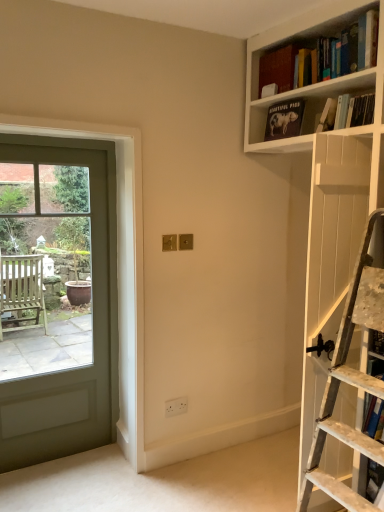
What are the coordinates of `matte black book at upper right, acting as the 4th book starting from the bottom` in the screenshot? It's located at (284, 119).

What do you see at coordinates (373, 480) in the screenshot? I see `blue hardcover book at right, which is the 5th book in top-to-bottom order` at bounding box center [373, 480].

Image resolution: width=384 pixels, height=512 pixels. What are the coordinates of `hardcover book at upper right, the second book in the bottom-to-top sequence` in the screenshot? It's located at (347, 112).

This screenshot has width=384, height=512. Describe the element at coordinates (347, 112) in the screenshot. I see `hardcover book at upper right, the second book in the bottom-to-top sequence` at that location.

At what (x,y) coordinates should I click in order to perform the action: click on matte glass door at left. Please return your answer as a coordinate pair (x, y). Looking at the image, I should click on (57, 298).

Considering the sizes of objects hardcover book at upper right, the second book in the bottom-to-top sequence, and hardcover book at upper right, which is the third book from bottom to top, in the image provided, who is taller, hardcover book at upper right, the second book in the bottom-to-top sequence, or hardcover book at upper right, which is the third book from bottom to top,?

With more height is hardcover book at upper right, which is the third book from bottom to top.

How far apart are hardcover book at upper right, the fourth book when ordered from top to bottom, and hardcover book at upper right, which is the third book from bottom to top?

The distance of hardcover book at upper right, the fourth book when ordered from top to bottom, from hardcover book at upper right, which is the third book from bottom to top, is 2.00 inches.

Choose the correct answer: Is hardcover book at upper right, the second book in the bottom-to-top sequence, inside hardcover book at upper right, marked as the third book in a top-to-bottom arrangement, or outside it?

hardcover book at upper right, the second book in the bottom-to-top sequence, is spatially situated outside hardcover book at upper right, marked as the third book in a top-to-bottom arrangement.

Is hardcover book at upper right, the second book in the bottom-to-top sequence, oriented away from hardcover book at upper right, marked as the third book in a top-to-bottom arrangement?

No, hardcover book at upper right, the second book in the bottom-to-top sequence, is not facing the opposite direction of hardcover book at upper right, marked as the third book in a top-to-bottom arrangement.

Which is more to the right, blue hardcover book at right, which is the 5th book in top-to-bottom order, or hardcover book at upper right, which is the third book from bottom to top?

Positioned to the right is blue hardcover book at right, which is the 5th book in top-to-bottom order.

Where is `the 2nd book positioned below the hardcover book at upper right, marked as the third book in a top-to-bottom arrangement (from the image's perspective)`? This screenshot has width=384, height=512. the 2nd book positioned below the hardcover book at upper right, marked as the third book in a top-to-bottom arrangement (from the image's perspective) is located at coordinates (373, 480).

In the image, is blue hardcover book at right, the 1th book positioned from the bottom, positioned in front of or behind hardcover book at upper right, which is the third book from bottom to top?

blue hardcover book at right, the 1th book positioned from the bottom, is in front of hardcover book at upper right, which is the third book from bottom to top.

Is blue hardcover book at right, the 1th book positioned from the bottom, facing towards hardcover book at upper right, which is the third book from bottom to top?

No, blue hardcover book at right, the 1th book positioned from the bottom, is not turned towards hardcover book at upper right, which is the third book from bottom to top.

Is matte glass door at left spatially inside hardcover book at upper right, marked as the third book in a top-to-bottom arrangement, or outside of it?

matte glass door at left is located beyond the bounds of hardcover book at upper right, marked as the third book in a top-to-bottom arrangement.

Is matte glass door at left far away from hardcover book at upper right, which is the third book from bottom to top?

Indeed, matte glass door at left is not near hardcover book at upper right, which is the third book from bottom to top.

From a real-world perspective, who is located higher, matte glass door at left or hardcover book at upper right, which is the third book from bottom to top?

From a 3D spatial view, hardcover book at upper right, which is the third book from bottom to top, is above.

From the image's perspective, is matte glass door at left positioned above or below hardcover book at upper right, marked as the third book in a top-to-bottom arrangement?

matte glass door at left is situated lower than hardcover book at upper right, marked as the third book in a top-to-bottom arrangement, in the image.

From a real-world perspective, count 2nd books upward from the hardcover book at upper right, the fourth book when ordered from top to bottom, and point to it. Please provide its 2D coordinates.

[(278, 68)]

In the scene shown: Which object is further away from the camera taking this photo, hardcover book at upper right, the second book in the bottom-to-top sequence, or hardcover book at upper right, the fifth book in the bottom-to-top sequence?

Positioned behind is hardcover book at upper right, the fifth book in the bottom-to-top sequence.

Does hardcover book at upper right, the fourth book when ordered from top to bottom, have a greater height compared to hardcover book at upper right, the fifth book in the bottom-to-top sequence?

Incorrect, the height of hardcover book at upper right, the fourth book when ordered from top to bottom, is not larger of that of hardcover book at upper right, the fifth book in the bottom-to-top sequence.

Which is more to the left, hardcover book at upper right, the fourth book when ordered from top to bottom, or hardcover book at upper right, acting as the 1th book starting from the top?

hardcover book at upper right, acting as the 1th book starting from the top, is more to the left.

Starting from the matte black book at upper right, acting as the 2th book starting from the top, which book is the 1st one in front? Please provide its 2D coordinates.

[(327, 116)]

Looking at this image, choose the correct answer: Is matte black book at upper right, acting as the 2th book starting from the top, inside hardcover book at upper right, which is the third book from bottom to top, or outside it?

matte black book at upper right, acting as the 2th book starting from the top, is located beyond the bounds of hardcover book at upper right, which is the third book from bottom to top.

Is matte black book at upper right, acting as the 2th book starting from the top, taller or shorter than hardcover book at upper right, marked as the third book in a top-to-bottom arrangement?

In the image, matte black book at upper right, acting as the 2th book starting from the top, appears to be taller than hardcover book at upper right, marked as the third book in a top-to-bottom arrangement.

Looking at this image, is matte black book at upper right, acting as the 2th book starting from the top, turned away from hardcover book at upper right, marked as the third book in a top-to-bottom arrangement?

That's not correct — matte black book at upper right, acting as the 2th book starting from the top, is not looking away from hardcover book at upper right, marked as the third book in a top-to-bottom arrangement.

Is blue hardcover book at right, which is the 5th book in top-to-bottom order, surrounded by hardcover book at upper right, which is the third book from bottom to top?

No, blue hardcover book at right, which is the 5th book in top-to-bottom order, is not surrounded by hardcover book at upper right, which is the third book from bottom to top.

Consider the image. From the image's perspective, is hardcover book at upper right, marked as the third book in a top-to-bottom arrangement, positioned above or below blue hardcover book at right, which is the 5th book in top-to-bottom order?

From the image's perspective, hardcover book at upper right, marked as the third book in a top-to-bottom arrangement, appears above blue hardcover book at right, which is the 5th book in top-to-bottom order.

Is hardcover book at upper right, marked as the third book in a top-to-bottom arrangement, closer to camera compared to blue hardcover book at right, which is the 5th book in top-to-bottom order?

No, hardcover book at upper right, marked as the third book in a top-to-bottom arrangement, is further to the viewer.

Who is shorter, hardcover book at upper right, which is the third book from bottom to top, or blue hardcover book at right, the 1th book positioned from the bottom?

Standing shorter between the two is hardcover book at upper right, which is the third book from bottom to top.

Based on the photo, between hardcover book at upper right, which is the third book from bottom to top, and matte glass door at left, which one appears on the left side from the viewer's perspective?

From the viewer's perspective, matte glass door at left appears more on the left side.

Consider the image. Considering the relative sizes of hardcover book at upper right, which is the third book from bottom to top, and matte glass door at left in the image provided, is hardcover book at upper right, which is the third book from bottom to top, wider than matte glass door at left?

Yes, hardcover book at upper right, which is the third book from bottom to top, is wider than matte glass door at left.

Consider the image. Is hardcover book at upper right, which is the third book from bottom to top, oriented towards matte glass door at left?

No, hardcover book at upper right, which is the third book from bottom to top, is not aimed at matte glass door at left.

How many degrees apart are the facing directions of hardcover book at upper right, marked as the third book in a top-to-bottom arrangement, and matte glass door at left?

They differ by 84.5 degrees in their facing directions.

From a real-world perspective, starting from the hardcover book at upper right, which is the third book from bottom to top, which book is the 1st one vertically above it? Please provide its 2D coordinates.

[(347, 112)]

Which book is the 2nd one when counting from the right side of the hardcover book at upper right, which is the third book from bottom to top? Please provide its 2D coordinates.

[(373, 480)]

Which object lies further to the anchor point hardcover book at upper right, which is the third book from bottom to top, blue hardcover book at right, the 1th book positioned from the bottom, or matte glass door at left?

Among the two, matte glass door at left is located further to hardcover book at upper right, which is the third book from bottom to top.

When comparing their distances from blue hardcover book at right, which is the 5th book in top-to-bottom order, does hardcover book at upper right, the fourth book when ordered from top to bottom, or matte black book at upper right, acting as the 4th book starting from the bottom, seem further?

Based on the image, matte black book at upper right, acting as the 4th book starting from the bottom, appears to be further to blue hardcover book at right, which is the 5th book in top-to-bottom order.

Which object lies nearer to the anchor point hardcover book at upper right, the second book in the bottom-to-top sequence, hardcover book at upper right, marked as the third book in a top-to-bottom arrangement, or hardcover book at upper right, the fifth book in the bottom-to-top sequence?

The object closer to hardcover book at upper right, the second book in the bottom-to-top sequence, is hardcover book at upper right, marked as the third book in a top-to-bottom arrangement.

From the image, which object appears to be farther from matte black book at upper right, acting as the 4th book starting from the bottom, hardcover book at upper right, which is the third book from bottom to top, or matte glass door at left?

matte glass door at left is further to matte black book at upper right, acting as the 4th book starting from the bottom.

Looking at the image, which one is located closer to matte black book at upper right, acting as the 2th book starting from the top, hardcover book at upper right, the fourth book when ordered from top to bottom, or matte glass door at left?

hardcover book at upper right, the fourth book when ordered from top to bottom, is positioned closer to the anchor matte black book at upper right, acting as the 2th book starting from the top.

Based on their spatial positions, is matte black book at upper right, acting as the 2th book starting from the top, or blue hardcover book at right, the 1th book positioned from the bottom, closer to hardcover book at upper right, the second book in the bottom-to-top sequence?

Among the two, matte black book at upper right, acting as the 2th book starting from the top, is located nearer to hardcover book at upper right, the second book in the bottom-to-top sequence.

When comparing their distances from matte glass door at left, does hardcover book at upper right, acting as the 1th book starting from the top, or hardcover book at upper right, the fourth book when ordered from top to bottom, seem closer?

hardcover book at upper right, acting as the 1th book starting from the top, is positioned closer to the anchor matte glass door at left.

Looking at the image, which one is located closer to matte glass door at left, matte black book at upper right, acting as the 4th book starting from the bottom, or hardcover book at upper right, the second book in the bottom-to-top sequence?

Among the two, matte black book at upper right, acting as the 4th book starting from the bottom, is located nearer to matte glass door at left.

You are a GUI agent. You are given a task and a screenshot of the screen. Output one action in this format:
    pyautogui.click(x=<x>, y=<y>)
    Task: Click on the book between hardcover book at upper right, the second book in the bottom-to-top sequence, and matte black book at upper right, acting as the 2th book starting from the top, along the z-axis
    The image size is (384, 512).
    Given the screenshot: What is the action you would take?
    pyautogui.click(x=327, y=116)

Find the location of `door between hardcover book at upper right, acting as the 1th book starting from the top, and blue hardcover book at right, the 1th book positioned from the bottom, in the up-down direction`. door between hardcover book at upper right, acting as the 1th book starting from the top, and blue hardcover book at right, the 1th book positioned from the bottom, in the up-down direction is located at coordinates (x=57, y=298).

Where is `book between matte glass door at left and hardcover book at upper right, the fifth book in the bottom-to-top sequence`? This screenshot has height=512, width=384. book between matte glass door at left and hardcover book at upper right, the fifth book in the bottom-to-top sequence is located at coordinates (284, 119).

Identify the location of book that lies between hardcover book at upper right, the fifth book in the bottom-to-top sequence, and hardcover book at upper right, which is the third book from bottom to top, from top to bottom. (284, 119).